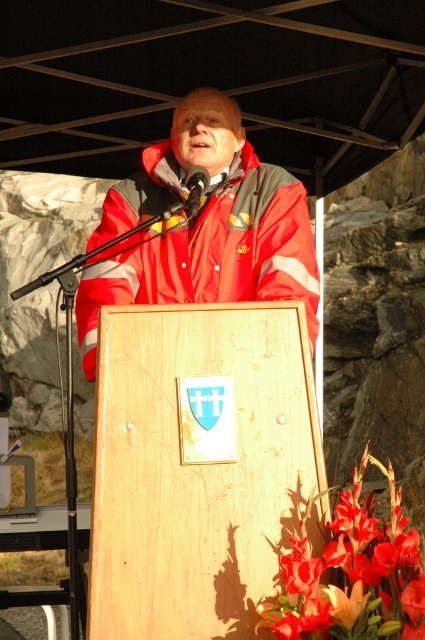
You are a photographer taking a picture of the man in the red matte jacket at center. The camera you are using has a focus point at position (203, 227). Will the focus point land on the man?

Yes, the focus point at (203, 227) will land on the man in the red matte jacket at center because the point marks the location of the jacket.

You are a photographer at the event and need to capture a clear shot of the metallic black microphone at center without the vivid red petals at lower right blocking it. How should you adjust your camera angle?

The vivid red petals at lower right are much taller than the metallic black microphone at center, so you should lower your camera angle to position the microphone above the petals and avoid obstruction.

You are a photographer at the event and want to capture a clear photo of the speaker. Since the red matte jacket at center and the metallic black microphone at center are both in the frame, which object should you focus on to ensure the speaker is sharp?

The red matte jacket at center is in front of the metallic black microphone at center, so focusing on the red matte jacket at center will ensure the speaker is sharp as it is closer to the camera.